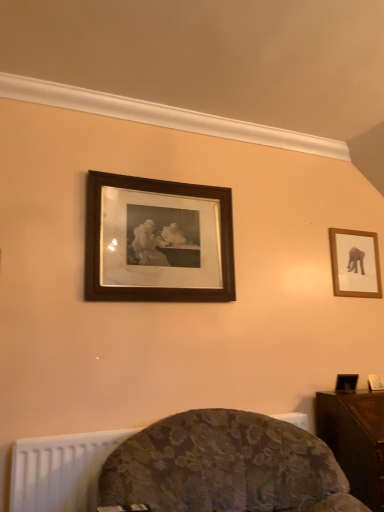
The image size is (384, 512). What do you see at coordinates (157, 241) in the screenshot?
I see `black wood picture frame at upper center, arranged as the 2th picture frame when viewed from the back` at bounding box center [157, 241].

What do you see at coordinates (355, 263) in the screenshot? I see `wooden frame at upper right, which is the first picture frame from back to front` at bounding box center [355, 263].

Describe the element at coordinates (355, 440) in the screenshot. The height and width of the screenshot is (512, 384). I see `dark wood table at lower right` at that location.

Identify the location of velvet floral chair at lower center. The image size is (384, 512). (224, 467).

Does dark wood table at lower right have a greater width compared to black wood picture frame at upper center, arranged as the 2th picture frame when viewed from the back?

Indeed, dark wood table at lower right has a greater width compared to black wood picture frame at upper center, arranged as the 2th picture frame when viewed from the back.

Considering the positions of objects dark wood table at lower right and black wood picture frame at upper center, the second picture frame when ordered from right to left, in the image provided, who is behind, dark wood table at lower right or black wood picture frame at upper center, the second picture frame when ordered from right to left,?

black wood picture frame at upper center, the second picture frame when ordered from right to left, is further away from the camera.

Is dark wood table at lower right inside the boundaries of black wood picture frame at upper center, which appears as the 1th picture frame when viewed from the front, or outside?

The correct answer is: outside.

Could you tell me if dark wood table at lower right is facing black wood picture frame at upper center, the second picture frame when ordered from right to left?

No, dark wood table at lower right is not turned towards black wood picture frame at upper center, the second picture frame when ordered from right to left.

How different are the orientations of wooden frame at upper right, the 2th picture frame when ordered from left to right, and velvet floral chair at lower center in degrees?

14.9 degrees.

Is wooden frame at upper right, the 2th picture frame when ordered from left to right, to the right of velvet floral chair at lower center from the viewer's perspective?

Correct, you'll find wooden frame at upper right, the 2th picture frame when ordered from left to right, to the right of velvet floral chair at lower center.

From the picture: Between wooden frame at upper right, the second picture frame viewed from the front, and velvet floral chair at lower center, which one has larger size?

velvet floral chair at lower center is bigger.

Is wooden frame at upper right, the 2th picture frame when ordered from left to right, turned away from velvet floral chair at lower center?

wooden frame at upper right, the 2th picture frame when ordered from left to right, does not have its back to velvet floral chair at lower center.

Is point (156, 222) positioned in front of point (347, 295)?

Yes, it is in front of point (347, 295).

Does black wood picture frame at upper center, the 1th picture frame positioned from the left, have a greater height compared to wooden frame at upper right, which is the first picture frame from back to front?

Correct, black wood picture frame at upper center, the 1th picture frame positioned from the left, is much taller as wooden frame at upper right, which is the first picture frame from back to front.

Which object is closer to the camera taking this photo, black wood picture frame at upper center, which appears as the 1th picture frame when viewed from the front, or wooden frame at upper right, the 2th picture frame when ordered from left to right?

black wood picture frame at upper center, which appears as the 1th picture frame when viewed from the front, is more forward.

From the image's perspective, is black wood picture frame at upper center, arranged as the 2th picture frame when viewed from the back, located above or below wooden frame at upper right, which is the first picture frame from back to front?

black wood picture frame at upper center, arranged as the 2th picture frame when viewed from the back, is situated higher than wooden frame at upper right, which is the first picture frame from back to front, in the image.

The image size is (384, 512). What are the coordinates of `furniture below the wooden frame at upper right, the second picture frame viewed from the front (from the image's perspective)` in the screenshot? It's located at (224, 467).

Is velvet floral chair at lower center directly adjacent to wooden frame at upper right, which is the first picture frame from back to front?

velvet floral chair at lower center and wooden frame at upper right, which is the first picture frame from back to front, are clearly separated.

Do you think velvet floral chair at lower center is within wooden frame at upper right, which is the first picture frame from back to front, or outside of it?

velvet floral chair at lower center is outside wooden frame at upper right, which is the first picture frame from back to front.

Between velvet floral chair at lower center and wooden frame at upper right, the second picture frame viewed from the front, which one has larger size?

With larger size is velvet floral chair at lower center.

From the image's perspective, which is below, wooden frame at upper right, the second picture frame viewed from the front, or dark wood table at lower right?

From the image's view, dark wood table at lower right is below.

Considering the positions of point (350, 260) and point (379, 501), is point (350, 260) closer or farther from the camera than point (379, 501)?

Clearly, point (350, 260) is more distant from the camera than point (379, 501).

Does wooden frame at upper right, the second picture frame viewed from the front, have a lesser width compared to dark wood table at lower right?

Yes.

Does dark wood table at lower right lie in front of wooden frame at upper right, the second picture frame viewed from the front?

Yes, dark wood table at lower right is in front of wooden frame at upper right, the second picture frame viewed from the front.

Is dark wood table at lower right to the left of wooden frame at upper right, which is the first picture frame from back to front, from the viewer's perspective?

Yes.

From the image's perspective, who appears lower, dark wood table at lower right or wooden frame at upper right, the 2th picture frame when ordered from left to right?

dark wood table at lower right.

I want to click on furniture that is below the black wood picture frame at upper center, which appears as the 1th picture frame when viewed from the front (from the image's perspective), so click(224, 467).

Which of these two, velvet floral chair at lower center or black wood picture frame at upper center, arranged as the 2th picture frame when viewed from the back, is bigger?

Bigger between the two is velvet floral chair at lower center.

From the image's perspective, between velvet floral chair at lower center and black wood picture frame at upper center, the 1th picture frame positioned from the left, which one is located above?

black wood picture frame at upper center, the 1th picture frame positioned from the left, from the image's perspective.

Locate an element on the screen. This screenshot has height=512, width=384. table in front of the black wood picture frame at upper center, which appears as the 1th picture frame when viewed from the front is located at coordinates (355, 440).

Starting from the velvet floral chair at lower center, which picture frame is the 2nd one behind? Please provide its 2D coordinates.

[(355, 263)]

When comparing their distances from velvet floral chair at lower center, does black wood picture frame at upper center, which appears as the 1th picture frame when viewed from the front, or dark wood table at lower right seem further?

black wood picture frame at upper center, which appears as the 1th picture frame when viewed from the front.

Consider the image. Which object lies nearer to the anchor point velvet floral chair at lower center, black wood picture frame at upper center, arranged as the 2th picture frame when viewed from the back, or wooden frame at upper right, the second picture frame viewed from the front?

black wood picture frame at upper center, arranged as the 2th picture frame when viewed from the back, is closer to velvet floral chair at lower center.

Which object lies nearer to the anchor point dark wood table at lower right, velvet floral chair at lower center or wooden frame at upper right, the 2th picture frame when ordered from left to right?

Among the two, velvet floral chair at lower center is located nearer to dark wood table at lower right.

Based on their spatial positions, is wooden frame at upper right, which is the first picture frame from back to front, or dark wood table at lower right closer to velvet floral chair at lower center?

dark wood table at lower right is closer to velvet floral chair at lower center.

Looking at the image, which one is located further to black wood picture frame at upper center, the 1th picture frame positioned from the left, dark wood table at lower right or wooden frame at upper right, the 2th picture frame when ordered from left to right?

Based on the image, dark wood table at lower right appears to be further to black wood picture frame at upper center, the 1th picture frame positioned from the left.

When comparing their distances from velvet floral chair at lower center, does dark wood table at lower right or black wood picture frame at upper center, arranged as the 2th picture frame when viewed from the back, seem further?

black wood picture frame at upper center, arranged as the 2th picture frame when viewed from the back, is positioned further to the anchor velvet floral chair at lower center.

When comparing their distances from dark wood table at lower right, does black wood picture frame at upper center, arranged as the 2th picture frame when viewed from the back, or wooden frame at upper right, the 2th picture frame when ordered from left to right, seem closer?

Among the two, wooden frame at upper right, the 2th picture frame when ordered from left to right, is located nearer to dark wood table at lower right.

Which object lies further to the anchor point black wood picture frame at upper center, arranged as the 2th picture frame when viewed from the back, velvet floral chair at lower center or wooden frame at upper right, the second picture frame viewed from the front?

wooden frame at upper right, the second picture frame viewed from the front, is positioned further to the anchor black wood picture frame at upper center, arranged as the 2th picture frame when viewed from the back.

The width and height of the screenshot is (384, 512). I want to click on table between black wood picture frame at upper center, the second picture frame when ordered from right to left, and wooden frame at upper right, the 1th picture frame when ordered from right to left, in the horizontal direction, so click(x=355, y=440).

This screenshot has width=384, height=512. I want to click on picture frame located between velvet floral chair at lower center and wooden frame at upper right, which is the first picture frame from back to front, in the depth direction, so click(x=157, y=241).

Find the location of a particular element. Image resolution: width=384 pixels, height=512 pixels. furniture between black wood picture frame at upper center, the 1th picture frame positioned from the left, and dark wood table at lower right in the up-down direction is located at coordinates (224, 467).

What are the coordinates of `table between velvet floral chair at lower center and wooden frame at upper right, which is the first picture frame from back to front, in the front-back direction` in the screenshot? It's located at (355, 440).